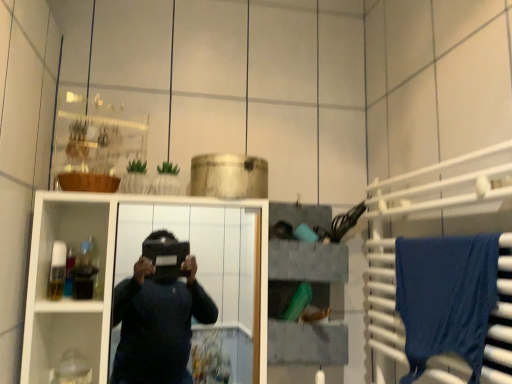
Question: From the image's perspective, is blue fabric towel at right above gray fabric storage at upper center?

Choices:
 (A) yes
 (B) no

Answer: (B)

Question: Is blue fabric towel at right bigger than gray fabric storage at upper center?

Choices:
 (A) yes
 (B) no

Answer: (B)

Question: From a real-world perspective, is blue fabric towel at right physically below gray fabric storage at upper center?

Choices:
 (A) no
 (B) yes

Answer: (B)

Question: Is blue fabric towel at right oriented towards gray fabric storage at upper center?

Choices:
 (A) no
 (B) yes

Answer: (A)

Question: Is blue fabric towel at right outside of gray fabric storage at upper center?

Choices:
 (A) no
 (B) yes

Answer: (B)

Question: Does blue fabric towel at right have a smaller size compared to gray fabric storage at upper center?

Choices:
 (A) no
 (B) yes

Answer: (B)

Question: Does gray fabric storage at upper center turn towards white glossy cabinet at center?

Choices:
 (A) no
 (B) yes

Answer: (A)

Question: Can you confirm if gray fabric storage at upper center is thinner than white glossy cabinet at center?

Choices:
 (A) no
 (B) yes

Answer: (B)

Question: Is gray fabric storage at upper center shorter than white glossy cabinet at center?

Choices:
 (A) yes
 (B) no

Answer: (A)

Question: From the image's perspective, is gray fabric storage at upper center over white glossy cabinet at center?

Choices:
 (A) yes
 (B) no

Answer: (A)

Question: Is gray fabric storage at upper center positioned beyond the bounds of white glossy cabinet at center?

Choices:
 (A) no
 (B) yes

Answer: (B)

Question: Is gray fabric storage at upper center not close to white glossy cabinet at center?

Choices:
 (A) no
 (B) yes

Answer: (B)

Question: Is blue fabric at right surrounding gray fabric storage at upper center?

Choices:
 (A) no
 (B) yes

Answer: (A)